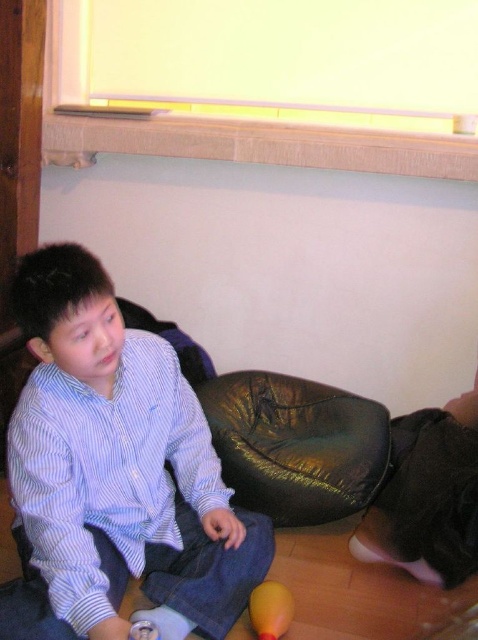
You are a delivery robot that needs to place a package between the blue striped shirt at center and the shiny gold bean bag chair at center. Can you fit the package in the space between them if the package is 19 inches long?

The distance between the blue striped shirt at center and the shiny gold bean bag chair at center is 18.85 inches. Since the package is 19 inches long, it is slightly longer than the available space. Therefore, the package cannot fit between them.

You are standing at the entrance of the room and want to sit on the shiny gold bean bag chair at center. According to the coordinates provided, where should you move to reach it?

The shiny gold bean bag chair at center is located at coordinates point (295, 445), so you should move towards that point to reach it.

You are trying to decide whether to place the shiny gold bean bag chair at center on top of the yellow rubber ball at lower center. Based on their sizes, will the bean bag chair fit over the ball without the ball rolling away?

The shiny gold bean bag chair at center is bigger than the yellow rubber ball at lower center, so the bean bag chair can fit over the ball. However, since the ball is smaller and likely less stable, it might roll away unless secured.